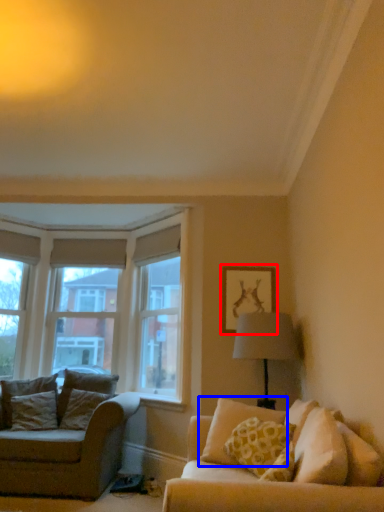
Question: Which of the following is the farthest to the observer, picture frame (highlighted by a red box) or pillow (highlighted by a blue box)?

Choices:
 (A) picture frame
 (B) pillow

Answer: (A)